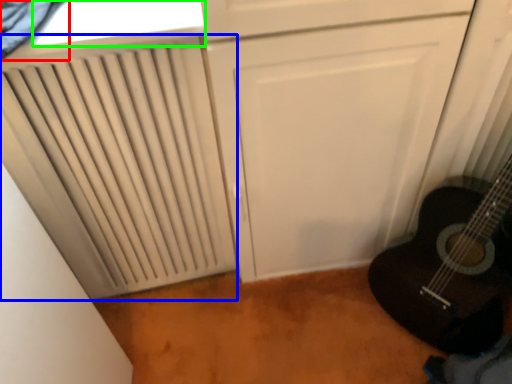
Question: Which object is the closest to the curtain (highlighted by a red box)? Choose among these: radiator (highlighted by a blue box) or window (highlighted by a green box).

Choices:
 (A) radiator
 (B) window

Answer: (B)